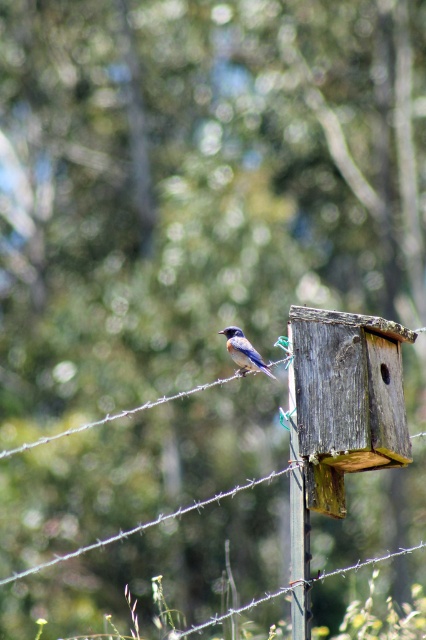
Is wooden post at center positioned in front of blue glossy bird at center?

Yes, it is in front of blue glossy bird at center.

Which is below, wooden post at center or blue glossy bird at center?

wooden post at center is below.

Is point (307, 625) positioned in front of point (247, 349)?

That is True.

This screenshot has width=426, height=640. I want to click on wooden post at center, so click(298, 525).